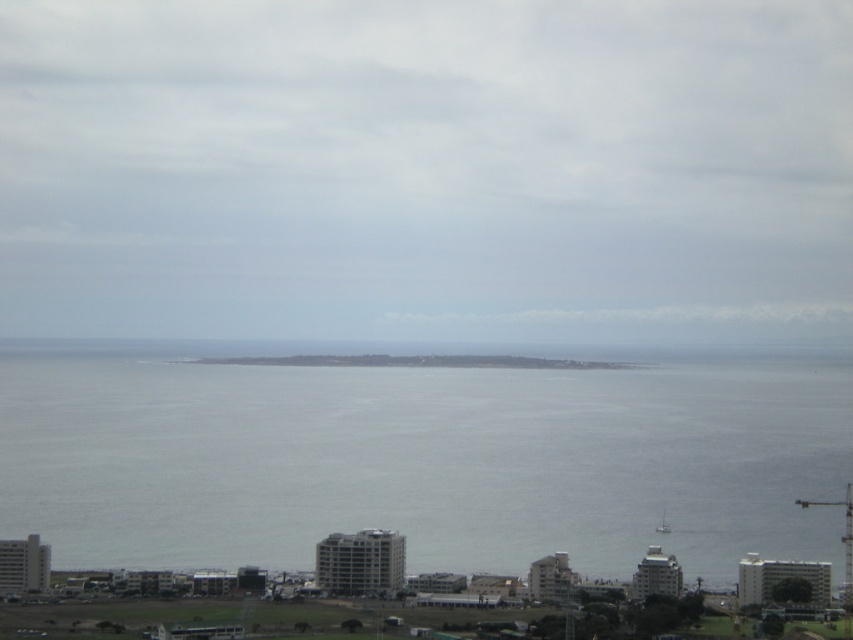
Question: Which object appears closest to the camera in this image?

Choices:
 (A) gray concrete coast at center
 (B) gray water at center

Answer: (B)

Question: From the image, what is the correct spatial relationship of gray water at center in relation to gray concrete coast at center?

Choices:
 (A) left
 (B) right

Answer: (B)

Question: Can you confirm if gray water at center is positioned below gray concrete coast at center?

Choices:
 (A) yes
 (B) no

Answer: (A)

Question: Can you confirm if gray water at center is positioned to the left of gray concrete coast at center?

Choices:
 (A) no
 (B) yes

Answer: (A)

Question: Which point appears farthest from the camera in this image?

Choices:
 (A) (283, 492)
 (B) (264, 360)

Answer: (A)